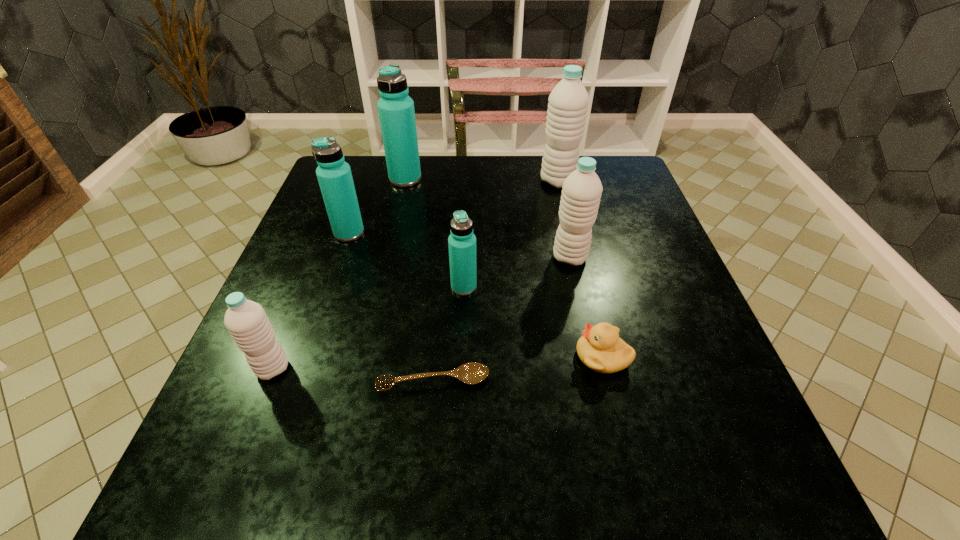
What are the coordinates of `blank space that satisfies the following two spatial constraints: 1. on the front side of the smallest blue water bottle; 2. on the left side of the fourth water bottle from right to left` in the screenshot? It's located at (381, 287).

At what (x,y) coordinates should I click in order to perform the action: click on free space that satisfies the following two spatial constraints: 1. on the back side of the rightmost blue water bottle; 2. on the right side of the nearest water bottle. Please return your answer as a coordinate pair (x, y). The image size is (960, 540). Looking at the image, I should click on (305, 287).